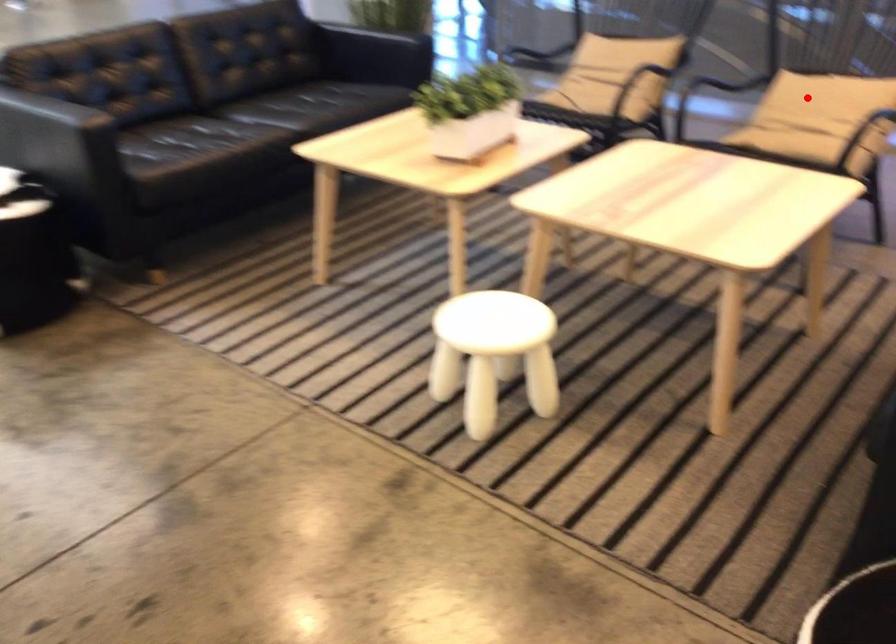
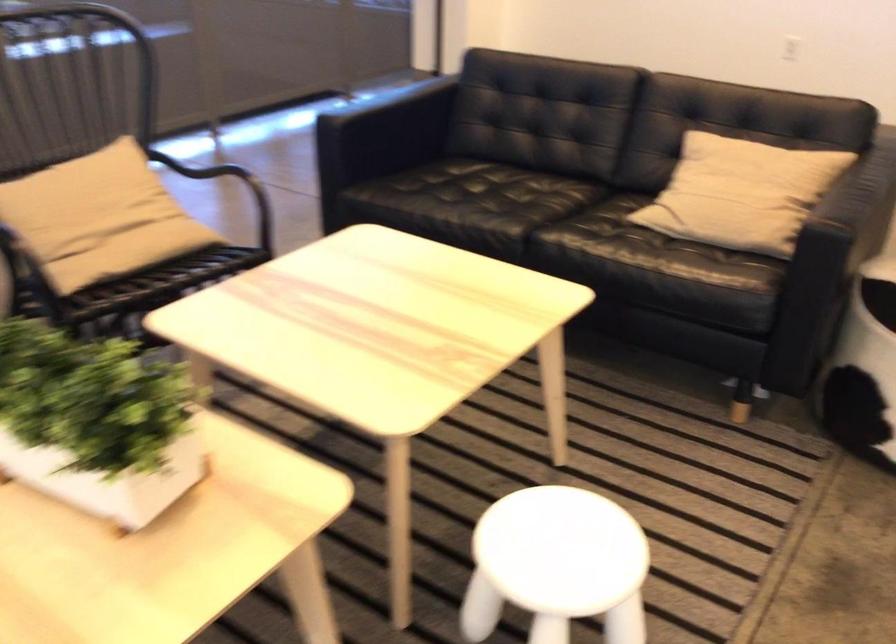
Question: I am providing you with two images of the same scene from different viewpoints. Image1 has a red point marked. In image2, the corresponding 3D location appears at what relative position? Reply with the corresponding letter.

Choices:
 (A) Closer
 (B) Farther

Answer: (A)